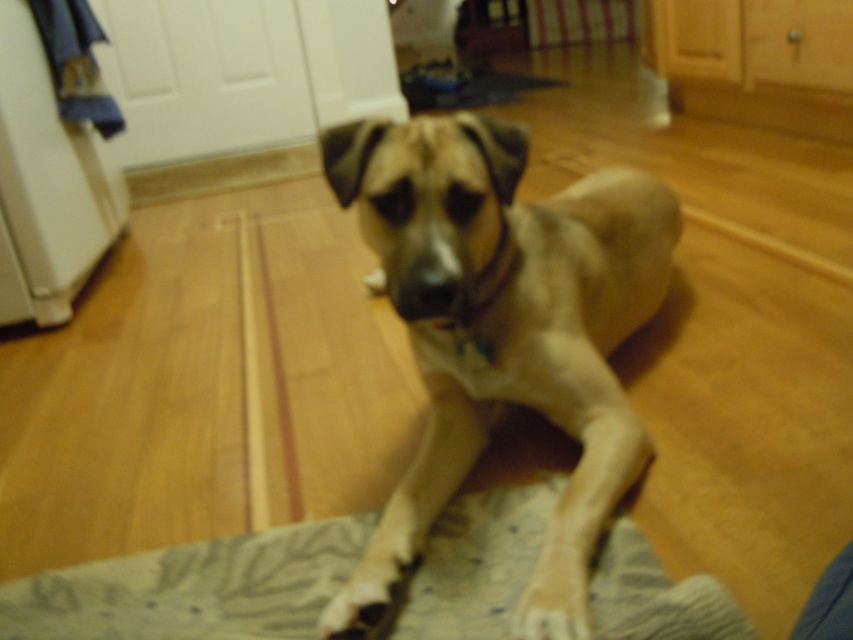
Question: Does tan smooth dog at center appear on the right side of textured gray mat at lower center?

Choices:
 (A) no
 (B) yes

Answer: (B)

Question: Which of the following is the farthest from the observer?

Choices:
 (A) textured gray mat at lower center
 (B) tan smooth dog at center

Answer: (B)

Question: Does tan smooth dog at center have a larger size compared to textured gray mat at lower center?

Choices:
 (A) yes
 (B) no

Answer: (A)

Question: Which point is farther to the camera?

Choices:
 (A) (566, 573)
 (B) (248, 630)

Answer: (B)

Question: Which point appears closest to the camera in this image?

Choices:
 (A) (120, 573)
 (B) (437, 388)

Answer: (A)

Question: Does tan smooth dog at center appear on the left side of textured gray mat at lower center?

Choices:
 (A) no
 (B) yes

Answer: (A)